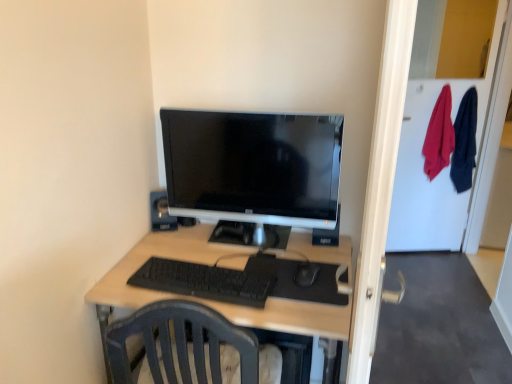
This screenshot has height=384, width=512. Find the location of `free area in between black matte keyboard at center and black plastic speaker at upper center`. free area in between black matte keyboard at center and black plastic speaker at upper center is located at coordinates (186, 251).